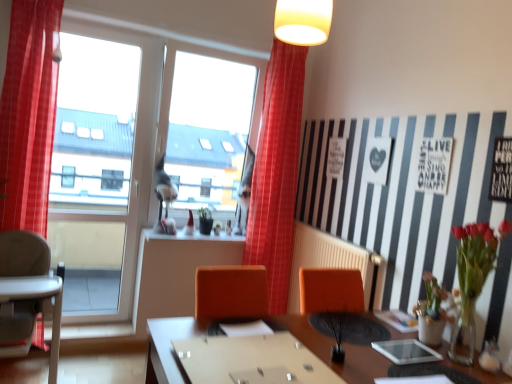
Question: Considering the relative positions of green matte plant at center, the 1th plant viewed from the back, and white plastic radiator at center in the image provided, is green matte plant at center, the 1th plant viewed from the back, to the left of white plastic radiator at center from the viewer's perspective?

Choices:
 (A) yes
 (B) no

Answer: (A)

Question: Does green matte plant at center, the first plant viewed from the left, have a greater height compared to white plastic radiator at center?

Choices:
 (A) yes
 (B) no

Answer: (B)

Question: Considering the relative sizes of green matte plant at center, the 1th plant viewed from the back, and white plastic radiator at center in the image provided, is green matte plant at center, the 1th plant viewed from the back, thinner than white plastic radiator at center?

Choices:
 (A) yes
 (B) no

Answer: (B)

Question: Is white plastic radiator at center completely or partially inside green matte plant at center, which is counted as the first plant, starting from the top?

Choices:
 (A) no
 (B) yes

Answer: (A)

Question: From a real-world perspective, is green matte plant at center, which is counted as the first plant, starting from the top, under white plastic radiator at center?

Choices:
 (A) yes
 (B) no

Answer: (B)

Question: Does point (327, 380) appear closer or farther from the camera than point (267, 187)?

Choices:
 (A) farther
 (B) closer

Answer: (B)

Question: Considering the positions of wooden table at center and red checkered curtain at center, which is the 2th curtain from left to right, in the image, is wooden table at center taller or shorter than red checkered curtain at center, which is the 2th curtain from left to right,?

Choices:
 (A) short
 (B) tall

Answer: (A)

Question: Visually, is wooden table at center positioned to the left or to the right of red checkered curtain at center, which is the 1th curtain from right to left?

Choices:
 (A) left
 (B) right

Answer: (A)

Question: Considering their positions, is wooden table at center located in front of or behind red checkered curtain at center, the 2th curtain when ordered from front to back?

Choices:
 (A) front
 (B) behind

Answer: (A)

Question: Based on their positions, is white plastic radiator at center located to the left or right of green matte plant at center, which is the second plant from bottom to top?

Choices:
 (A) left
 (B) right

Answer: (B)

Question: From a real-world perspective, is white plastic radiator at center positioned above or below green matte plant at center, the 1th plant viewed from the back?

Choices:
 (A) below
 (B) above

Answer: (A)

Question: Relative to green matte plant at center, which is the second plant in front-to-back order, is white plastic radiator at center in front or behind?

Choices:
 (A) front
 (B) behind

Answer: (A)

Question: Is white plastic radiator at center taller or shorter than green matte plant at center, which is the second plant in front-to-back order?

Choices:
 (A) tall
 (B) short

Answer: (A)

Question: From a real-world perspective, is gray plastic highchair at left physically located above or below wooden table at center?

Choices:
 (A) above
 (B) below

Answer: (B)

Question: Looking at their shapes, would you say gray plastic highchair at left is wider or thinner than wooden table at center?

Choices:
 (A) wide
 (B) thin

Answer: (B)